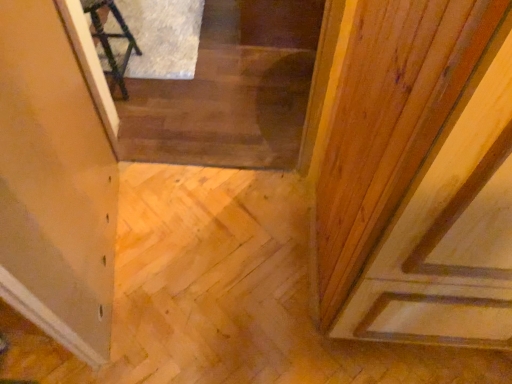
Identify the location of dark wood chair at upper left. (112, 37).

Identify the location of wooden stairs at center. This screenshot has height=384, width=512. (230, 91).

Is transparent glass door at upper left at the back of dark wood chair at upper left?

dark wood chair at upper left does not have its back to transparent glass door at upper left.

Based on the photo, from a real-world perspective, is dark wood chair at upper left above or below transparent glass door at upper left?

In terms of real-world spatial position, dark wood chair at upper left is below transparent glass door at upper left.

Which object is more forward, dark wood chair at upper left or transparent glass door at upper left?

transparent glass door at upper left is in front.

Between wooden stairs at center and dark wood chair at upper left, which one appears on the left side from the viewer's perspective?

dark wood chair at upper left is more to the left.

Does wooden stairs at center lie in front of dark wood chair at upper left?

No, wooden stairs at center is further to the viewer.

Which of these two, wooden stairs at center or dark wood chair at upper left, stands shorter?

With less height is wooden stairs at center.

Is point (147, 151) closer to viewer compared to point (84, 337)?

No, (147, 151) is further to viewer.

Is wooden stairs at center far from transparent glass door at upper left?

No.

Visually, is wooden stairs at center positioned to the left or to the right of transparent glass door at upper left?

From the image, it's evident that wooden stairs at center is to the right of transparent glass door at upper left.

Which is correct: wooden stairs at center is inside transparent glass door at upper left, or outside of it?

wooden stairs at center cannot be found inside transparent glass door at upper left.

From the picture: Which is in front, dark wood chair at upper left or wooden stairs at center?

Positioned in front is dark wood chair at upper left.

In terms of width, does dark wood chair at upper left look wider or thinner when compared to wooden stairs at center?

Clearly, dark wood chair at upper left has less width compared to wooden stairs at center.

Locate an element on the screen. stairwell below the dark wood chair at upper left (from the image's perspective) is located at coordinates (230, 91).

Who is taller, dark wood chair at upper left or wooden stairs at center?

dark wood chair at upper left is taller.

Considering the relative positions of transparent glass door at upper left and wooden stairs at center in the image provided, is transparent glass door at upper left to the right of wooden stairs at center from the viewer's perspective?

In fact, transparent glass door at upper left is to the left of wooden stairs at center.

Considering the positions of objects transparent glass door at upper left and wooden stairs at center in the image provided, who is in front, transparent glass door at upper left or wooden stairs at center?

transparent glass door at upper left.

Which of these two, transparent glass door at upper left or wooden stairs at center, is thinner?

transparent glass door at upper left is thinner.

How distant is transparent glass door at upper left from wooden stairs at center?

transparent glass door at upper left is 28.02 inches from wooden stairs at center.

Based on their positions, is transparent glass door at upper left located to the left or right of dark wood chair at upper left?

Based on their positions, transparent glass door at upper left is located to the right of dark wood chair at upper left.

Is transparent glass door at upper left taller than dark wood chair at upper left?

Yes, transparent glass door at upper left is taller than dark wood chair at upper left.

From a real-world perspective, is transparent glass door at upper left positioned above or below dark wood chair at upper left?

transparent glass door at upper left is situated higher than dark wood chair at upper left in the real world.

In the image, is transparent glass door at upper left positioned in front of or behind dark wood chair at upper left?

Clearly, transparent glass door at upper left is in front of dark wood chair at upper left.

Identify the location of furniture on the left of transparent glass door at upper left. (112, 37).

Identify the location of stairwell that appears behind the dark wood chair at upper left. (230, 91).

Looking at the image, which one is located further to transparent glass door at upper left, wooden stairs at center or dark wood chair at upper left?

Among the two, dark wood chair at upper left is located further to transparent glass door at upper left.

Which object lies nearer to the anchor point dark wood chair at upper left, transparent glass door at upper left or wooden stairs at center?

wooden stairs at center.

Based on their spatial positions, is wooden stairs at center or transparent glass door at upper left further from dark wood chair at upper left?

transparent glass door at upper left is further to dark wood chair at upper left.

From the image, which object appears to be farther from wooden stairs at center, transparent glass door at upper left or dark wood chair at upper left?

transparent glass door at upper left is further to wooden stairs at center.

Looking at the image, which one is located further to transparent glass door at upper left, dark wood chair at upper left or wooden stairs at center?

dark wood chair at upper left.

From the image, which object appears to be nearer to wooden stairs at center, dark wood chair at upper left or transparent glass door at upper left?

Based on the image, dark wood chair at upper left appears to be nearer to wooden stairs at center.

The height and width of the screenshot is (384, 512). Find the location of `furniture between transparent glass door at upper left and wooden stairs at center from front to back`. furniture between transparent glass door at upper left and wooden stairs at center from front to back is located at coordinates (112, 37).